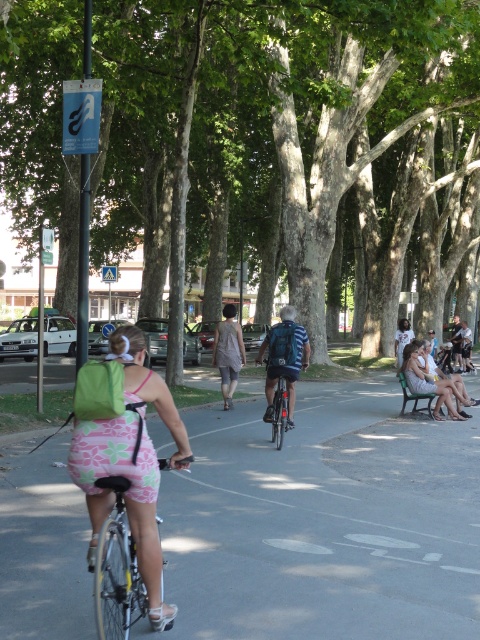
You are a pedestrian trying to find shade while walking along the pathway. You see the green leafy tree at center and the green plastic bench at lower right. Which object can provide shade for you to sit on the bench?

The green leafy tree at center is above the green plastic bench at lower right, so the bench is shaded by the tree. You can sit there to enjoy the shade.

You are standing at the starting point of the pathway and want to reach a destination located at point (282, 428). There is an obstacle at point (395, 148). Will you need to go around the obstacle to reach your destination?

Point (395, 148) is further to the camera than point (282, 428), so the obstacle at point (395, 148) is closer to you. Therefore, you will need to go around it to reach your destination at point (282, 428).